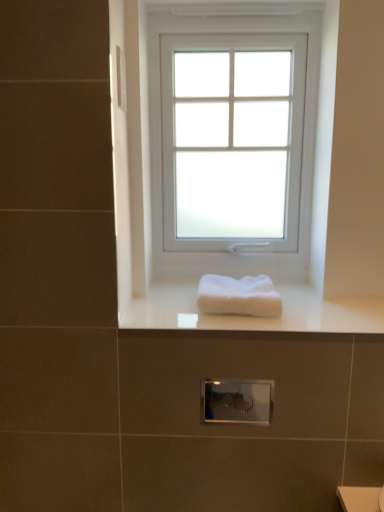
Question: From the image's perspective, relative to white fluffy towel at center, is white frosted glass window at center above or below?

Choices:
 (A) above
 (B) below

Answer: (A)

Question: In terms of width, does white frosted glass window at center look wider or thinner when compared to white fluffy towel at center?

Choices:
 (A) thin
 (B) wide

Answer: (A)

Question: Estimate the real-world distances between objects in this image. Which object is farther from the white frosted glass window at center?

Choices:
 (A) white glossy towel at center
 (B) white fluffy towel at center

Answer: (B)

Question: Which object is the closest to the white glossy towel at center?

Choices:
 (A) white fluffy towel at center
 (B) white frosted glass window at center

Answer: (A)